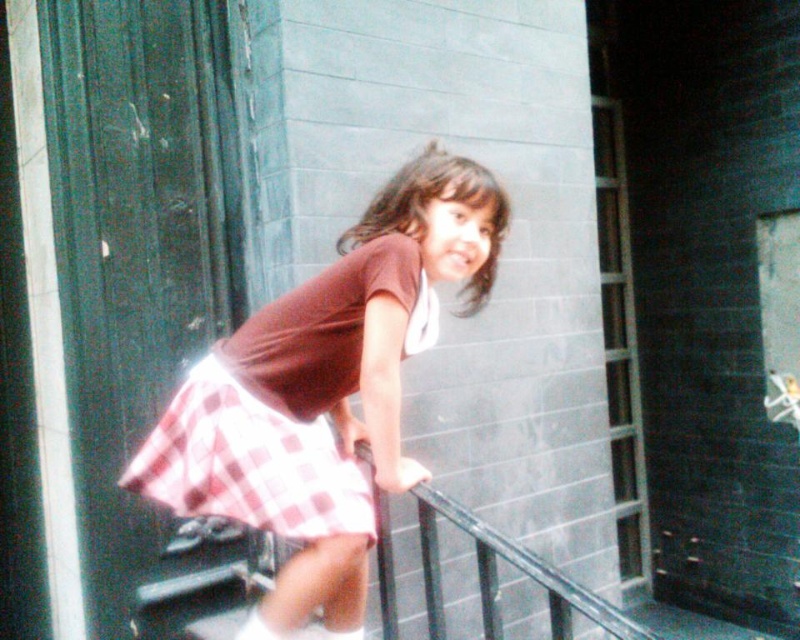
Question: Is pink checkered skirt at center to the right of red checkered skirt at center from the viewer's perspective?

Choices:
 (A) no
 (B) yes

Answer: (B)

Question: Observing the image, what is the correct spatial positioning of pink checkered skirt at center in reference to red checkered skirt at center?

Choices:
 (A) right
 (B) left

Answer: (A)

Question: Is pink checkered skirt at center positioned behind red checkered skirt at center?

Choices:
 (A) no
 (B) yes

Answer: (B)

Question: Which point is farther from the camera taking this photo?

Choices:
 (A) (276, 428)
 (B) (401, 248)

Answer: (B)